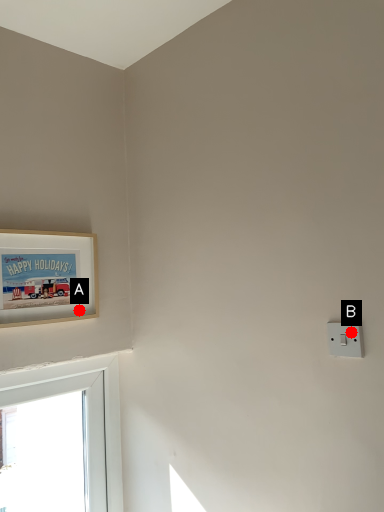
Question: Two points are circled on the image, labeled by A and B beside each circle. Which point appears farthest from the camera in this image?

Choices:
 (A) A is further
 (B) B is further

Answer: (A)